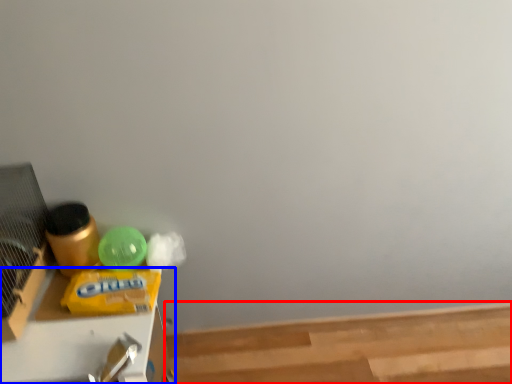
Question: Which of the following is the farthest to the observer, wood (highlighted by a red box) or furniture (highlighted by a blue box)?

Choices:
 (A) wood
 (B) furniture

Answer: (A)